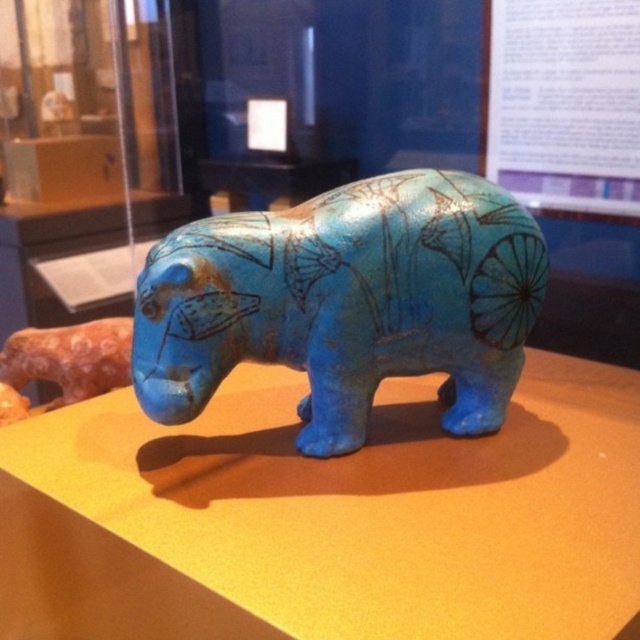
Who is more forward, (445, 470) or (413, 257)?

Positioned in front is point (445, 470).

At what (x,y) coordinates should I click in order to perform the action: click on matte blue hippo at center. Please return your answer as a coordinate pair (x, y). The height and width of the screenshot is (640, 640). Looking at the image, I should click on (372, 502).